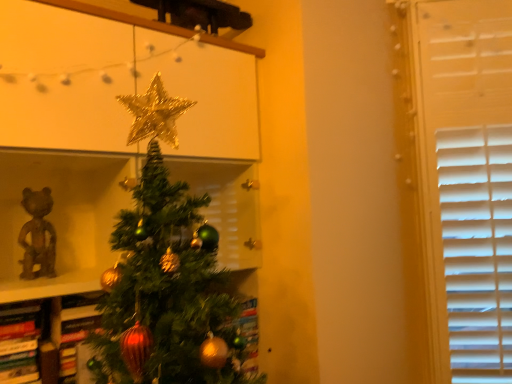
Describe the element at coordinates (166, 276) in the screenshot. This screenshot has width=512, height=384. I see `shiny green christmas tree at center` at that location.

Image resolution: width=512 pixels, height=384 pixels. I want to click on shiny green christmas tree at center, so click(x=166, y=276).

Find the location of a particular element. Image resolution: width=512 pixels, height=384 pixels. shiny green christmas tree at center is located at coordinates (166, 276).